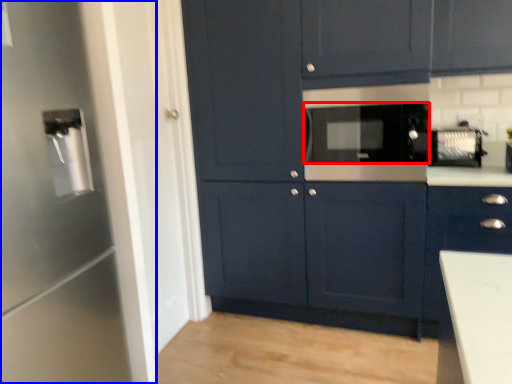
Question: Among these objects, which one is farthest to the camera, appliance (highlighted by a red box) or appliance (highlighted by a blue box)?

Choices:
 (A) appliance
 (B) appliance

Answer: (A)